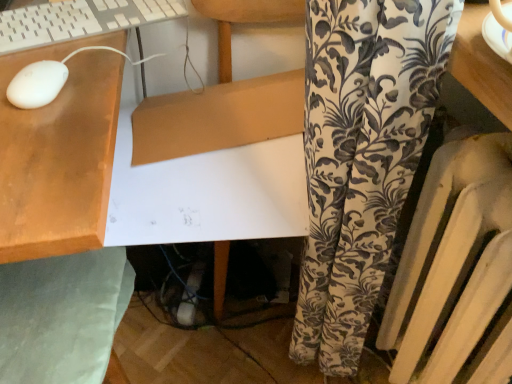
Question: From the image's perspective, relative to white matte mouse at upper left, is green fabric swivel chair at lower left above or below?

Choices:
 (A) below
 (B) above

Answer: (A)

Question: Looking at the image, does green fabric swivel chair at lower left seem bigger or smaller compared to white matte mouse at upper left?

Choices:
 (A) small
 (B) big

Answer: (B)

Question: Based on their relative distances, which object is nearer to the green fabric swivel chair at lower left?

Choices:
 (A) white plastic radiator at right
 (B) white plastic keyboard at upper left
 (C) white matte mouse at upper left

Answer: (C)

Question: Which object is positioned farthest from the white plastic keyboard at upper left?

Choices:
 (A) white matte mouse at upper left
 (B) green fabric swivel chair at lower left
 (C) white plastic radiator at right

Answer: (C)